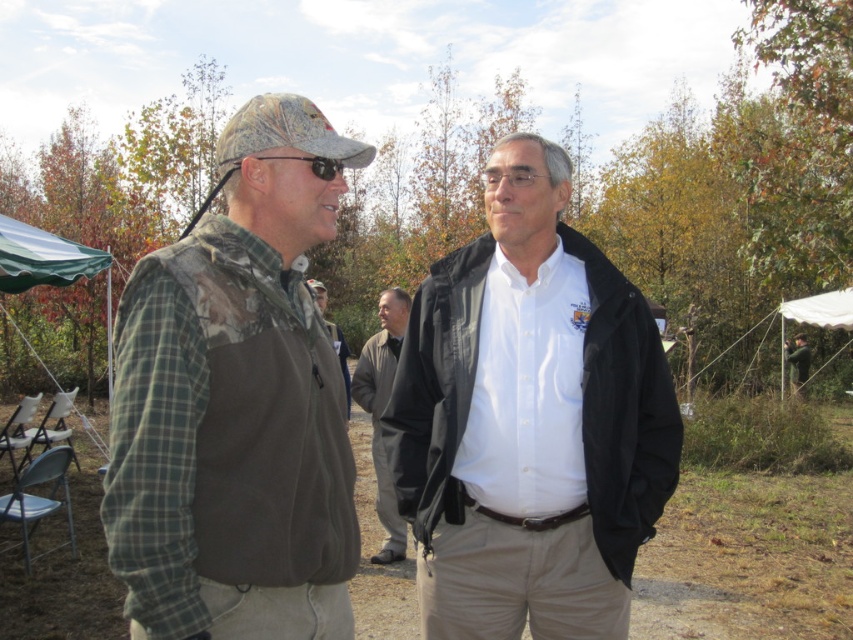
Does camouflage fabric vest at center appear over camouflage jacket at center?

No, camouflage fabric vest at center is not above camouflage jacket at center.

Which of these two, camouflage fabric vest at center or camouflage jacket at center, stands shorter?

With less height is camouflage fabric vest at center.

This screenshot has height=640, width=853. In order to click on camouflage fabric vest at center in this screenshot , I will do `click(236, 403)`.

Who is taller, dark gray jacket at center or white fabric canopy at right?

With more height is white fabric canopy at right.

Is dark gray jacket at center wider than white fabric canopy at right?

In fact, dark gray jacket at center might be narrower than white fabric canopy at right.

Which is behind, point (393, 291) or point (827, 298)?

Point (827, 298)

Where is `dark gray jacket at center`? The image size is (853, 640). dark gray jacket at center is located at coordinates (381, 410).

Between white matte shirt at center and white fabric canopy at right, which one has less height?

white fabric canopy at right is shorter.

Is white matte shirt at center positioned before white fabric canopy at right?

Yes, white matte shirt at center is in front of white fabric canopy at right.

Image resolution: width=853 pixels, height=640 pixels. What do you see at coordinates (529, 420) in the screenshot?
I see `white matte shirt at center` at bounding box center [529, 420].

Locate an element on the screen. white matte shirt at center is located at coordinates (529, 420).